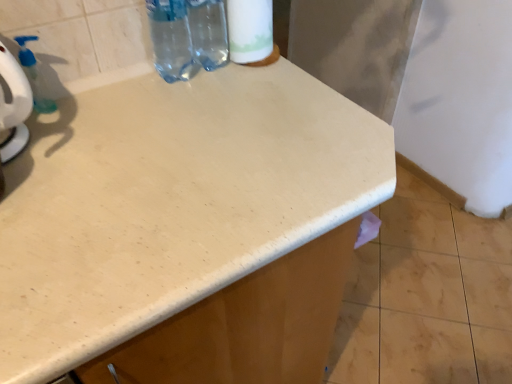
Question: Would you say transparent plastic soap dispenser at upper left is to the left or to the right of transparent plastic bottle at upper center, which is the second bottle in right-to-left order, in the picture?

Choices:
 (A) right
 (B) left

Answer: (B)

Question: In terms of size, does transparent plastic soap dispenser at upper left appear bigger or smaller than transparent plastic bottle at upper center, which is the second bottle in right-to-left order?

Choices:
 (A) small
 (B) big

Answer: (A)

Question: Estimate the real-world distances between objects in this image. Which object is farther from the transparent plastic soap dispenser at upper left?

Choices:
 (A) transparent plastic bottle at upper center, which is counted as the 1th bottle, starting from the right
 (B) transparent plastic bottle at upper center, the first bottle viewed from the left
 (C) white matte toilet paper at upper center
 (D) beige speckled countertop at center

Answer: (D)

Question: Based on their relative distances, which object is farther from the beige speckled countertop at center?

Choices:
 (A) transparent plastic bottle at upper center, the first bottle viewed from the left
 (B) transparent plastic bottle at upper center, arranged as the second bottle when viewed from the left
 (C) transparent plastic soap dispenser at upper left
 (D) white matte toilet paper at upper center

Answer: (C)